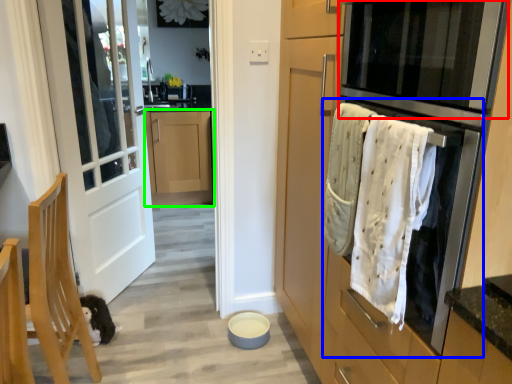
Question: Based on their relative distances, which object is farther from oven (highlighted by a red box)? Choose from oven (highlighted by a blue box) and cabinetry (highlighted by a green box).

Choices:
 (A) oven
 (B) cabinetry

Answer: (B)